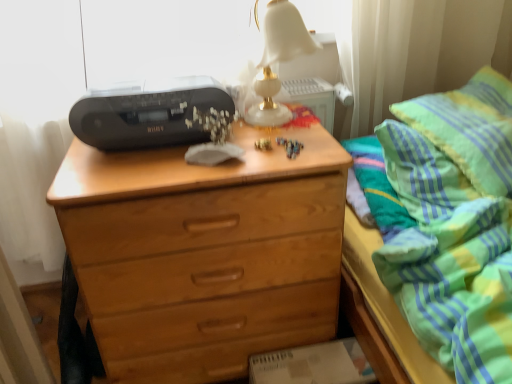
What is the approximate width of light brown wood chest of drawers at center?

17.36 inches.

Locate an element on the screen. The width and height of the screenshot is (512, 384). black plastic printer at upper left is located at coordinates (147, 113).

The image size is (512, 384). What do you see at coordinates (147, 113) in the screenshot?
I see `black plastic printer at upper left` at bounding box center [147, 113].

Image resolution: width=512 pixels, height=384 pixels. Describe the element at coordinates (470, 128) in the screenshot. I see `green striped pillow at upper right` at that location.

Image resolution: width=512 pixels, height=384 pixels. Find the location of `green striped fabric at upper right`. green striped fabric at upper right is located at coordinates (451, 223).

Where is `light brown wood chest of drawers at center`? light brown wood chest of drawers at center is located at coordinates (206, 256).

From the image's perspective, between light brown wood chest of drawers at center and green striped pillow at upper right, who is located below?

light brown wood chest of drawers at center, from the image's perspective.

This screenshot has width=512, height=384. I want to click on pillow lying above the light brown wood chest of drawers at center (from the image's perspective), so click(470, 128).

From the picture: Considering the sizes of objects light brown wood chest of drawers at center and green striped pillow at upper right in the image provided, who is shorter, light brown wood chest of drawers at center or green striped pillow at upper right?

Standing shorter between the two is green striped pillow at upper right.

Visually, is white marble table lamp at upper center positioned to the left or to the right of light brown wood chest of drawers at center?

white marble table lamp at upper center is positioned on light brown wood chest of drawers at center's right side.

From a real-world perspective, is white marble table lamp at upper center physically located above or below light brown wood chest of drawers at center?

Clearly, from a real-world perspective, white marble table lamp at upper center is above light brown wood chest of drawers at center.

Can you tell me how much white marble table lamp at upper center and light brown wood chest of drawers at center differ in facing direction?

The angular difference between white marble table lamp at upper center and light brown wood chest of drawers at center is 1.38 degrees.

In the scene shown: Considering the relative sizes of white marble table lamp at upper center and light brown wood chest of drawers at center in the image provided, is white marble table lamp at upper center shorter than light brown wood chest of drawers at center?

Yes.

Identify the location of table lamp above the light brown wood chest of drawers at center (from a real-world perspective). The width and height of the screenshot is (512, 384). (277, 59).

Relative to white marble table lamp at upper center, is light brown wood chest of drawers at center in front or behind?

In the image, light brown wood chest of drawers at center appears in front of white marble table lamp at upper center.

Between light brown wood chest of drawers at center and white marble table lamp at upper center, which one has smaller width?

Thinner between the two is white marble table lamp at upper center.

Which is in front, black plastic printer at upper left or white marble table lamp at upper center?

Positioned in front is white marble table lamp at upper center.

How different are the orientations of black plastic printer at upper left and white marble table lamp at upper center in degrees?

black plastic printer at upper left and white marble table lamp at upper center are facing 0.107 degrees away from each other.

Looking at their sizes, would you say black plastic printer at upper left is wider or thinner than white marble table lamp at upper center?

In the image, black plastic printer at upper left appears to be wider than white marble table lamp at upper center.

From a real-world perspective, who is located lower, green striped pillow at upper right or black plastic printer at upper left?

From a 3D spatial view, green striped pillow at upper right is below.

Is green striped pillow at upper right smaller than black plastic printer at upper left?

No, green striped pillow at upper right is not smaller than black plastic printer at upper left.

Is green striped pillow at upper right located outside black plastic printer at upper left?

Absolutely, green striped pillow at upper right is external to black plastic printer at upper left.

Is green striped pillow at upper right to the left or to the right of green striped fabric at upper right in the image?

From the image, it's evident that green striped pillow at upper right is to the right of green striped fabric at upper right.

From the image's perspective, which is below, green striped pillow at upper right or green striped fabric at upper right?

green striped fabric at upper right is shown below in the image.

Measure the distance from green striped pillow at upper right to green striped fabric at upper right.

A distance of 3.50 inches exists between green striped pillow at upper right and green striped fabric at upper right.

Is green striped pillow at upper right smaller than green striped fabric at upper right?

Indeed, green striped pillow at upper right has a smaller size compared to green striped fabric at upper right.

Is light brown wood chest of drawers at center oriented towards green striped fabric at upper right?

No, light brown wood chest of drawers at center is not aimed at green striped fabric at upper right.

Considering the sizes of objects light brown wood chest of drawers at center and green striped fabric at upper right in the image provided, who is shorter, light brown wood chest of drawers at center or green striped fabric at upper right?

light brown wood chest of drawers at center is shorter.

Which is more to the right, light brown wood chest of drawers at center or green striped fabric at upper right?

green striped fabric at upper right.

What's the angular difference between light brown wood chest of drawers at center and green striped fabric at upper right's facing directions?

There is a 89.7-degree angle between the facing directions of light brown wood chest of drawers at center and green striped fabric at upper right.

This screenshot has height=384, width=512. What are the coordinates of `the chest of drawers beneath the green striped pillow at upper right (from a real-world perspective)` in the screenshot? It's located at (206, 256).

You are a GUI agent. You are given a task and a screenshot of the screen. Output one action in this format:
    pyautogui.click(x=<x>, y=<y>)
    Task: Click on the table lamp above the light brown wood chest of drawers at center (from a real-world perspective)
    
    Given the screenshot: What is the action you would take?
    pyautogui.click(x=277, y=59)

Considering their positions, is light brown wood chest of drawers at center positioned closer to white marble table lamp at upper center than green striped pillow at upper right?

light brown wood chest of drawers at center lies closer to white marble table lamp at upper center than the other object.

Based on their spatial positions, is black plastic printer at upper left or green striped pillow at upper right further from white marble table lamp at upper center?

green striped pillow at upper right lies further to white marble table lamp at upper center than the other object.

When comparing their distances from green striped pillow at upper right, does light brown wood chest of drawers at center or black plastic printer at upper left seem further?

Based on the image, black plastic printer at upper left appears to be further to green striped pillow at upper right.

Considering their positions, is green striped pillow at upper right positioned further to light brown wood chest of drawers at center than white marble table lamp at upper center?

green striped pillow at upper right is further to light brown wood chest of drawers at center.

Estimate the real-world distances between objects in this image. Which object is closer to light brown wood chest of drawers at center, green striped fabric at upper right or green striped pillow at upper right?

green striped fabric at upper right.

Considering their positions, is light brown wood chest of drawers at center positioned further to black plastic printer at upper left than green striped fabric at upper right?

green striped fabric at upper right is positioned further to the anchor black plastic printer at upper left.

Considering their positions, is green striped fabric at upper right positioned closer to green striped pillow at upper right than black plastic printer at upper left?

green striped fabric at upper right.

Consider the image. Considering their positions, is black plastic printer at upper left positioned further to green striped pillow at upper right than light brown wood chest of drawers at center?

The object further to green striped pillow at upper right is black plastic printer at upper left.

At what (x,y) coordinates should I click in order to perform the action: click on printer between white marble table lamp at upper center and light brown wood chest of drawers at center in the up-down direction. Please return your answer as a coordinate pair (x, y). The width and height of the screenshot is (512, 384). Looking at the image, I should click on (147, 113).

Where is `chest of drawers between black plastic printer at upper left and green striped fabric at upper right from left to right`? chest of drawers between black plastic printer at upper left and green striped fabric at upper right from left to right is located at coordinates (206, 256).

Where is `bed located between white marble table lamp at upper center and green striped pillow at upper right in the left-right direction`? The height and width of the screenshot is (384, 512). bed located between white marble table lamp at upper center and green striped pillow at upper right in the left-right direction is located at coordinates (451, 223).

Where is `bed between light brown wood chest of drawers at center and green striped pillow at upper right in the horizontal direction`? bed between light brown wood chest of drawers at center and green striped pillow at upper right in the horizontal direction is located at coordinates (451, 223).